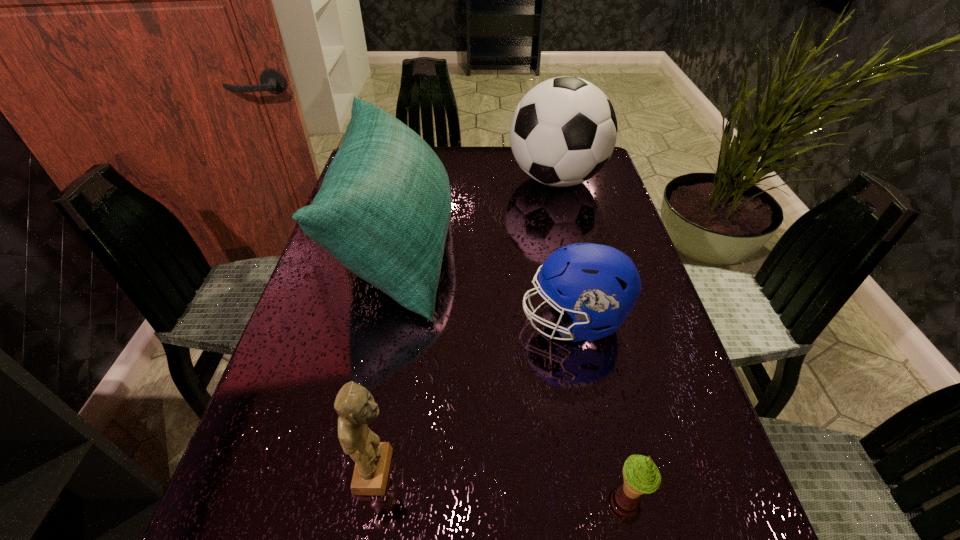
Locate an element on the screen. free space between the icecream and the fourth tallest object is located at coordinates (603, 406).

Find the location of a particular element. The width and height of the screenshot is (960, 540). free space between the football helmet and the cushion is located at coordinates (486, 284).

Where is `vacant area that lies between the cushion and the football helmet`? This screenshot has height=540, width=960. vacant area that lies between the cushion and the football helmet is located at coordinates (486, 284).

Where is `free space between the figurine and the soccer ball`? Image resolution: width=960 pixels, height=540 pixels. free space between the figurine and the soccer ball is located at coordinates (467, 325).

Where is `free spot between the cushion and the figurine`? Image resolution: width=960 pixels, height=540 pixels. free spot between the cushion and the figurine is located at coordinates (387, 359).

Locate an element on the screen. This screenshot has height=540, width=960. unoccupied area between the icecream and the cushion is located at coordinates (515, 369).

Find the location of a particular element. free point between the icecream and the figurine is located at coordinates (504, 481).

In order to click on blank region between the football helmet and the icecream in this screenshot , I will do `click(603, 406)`.

This screenshot has height=540, width=960. I want to click on free spot between the second shortest object and the figurine, so click(x=475, y=396).

Identify which object is the nearest to the soccer ball. Please provide its 2D coordinates. Your answer should be formatted as a tuple, i.e. [(x, y)], where the tuple contains the x and y coordinates of a point satisfying the conditions above.

[(383, 210)]